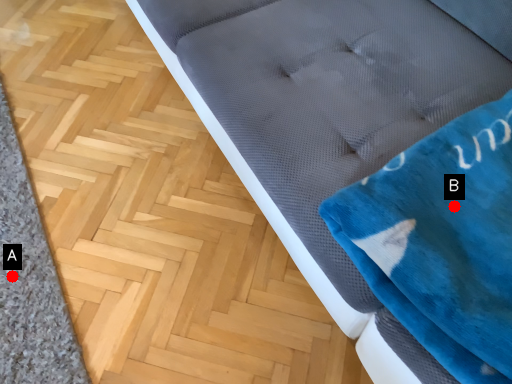
Question: Two points are circled on the image, labeled by A and B beside each circle. Which point is further to the camera?

Choices:
 (A) A is further
 (B) B is further

Answer: (A)